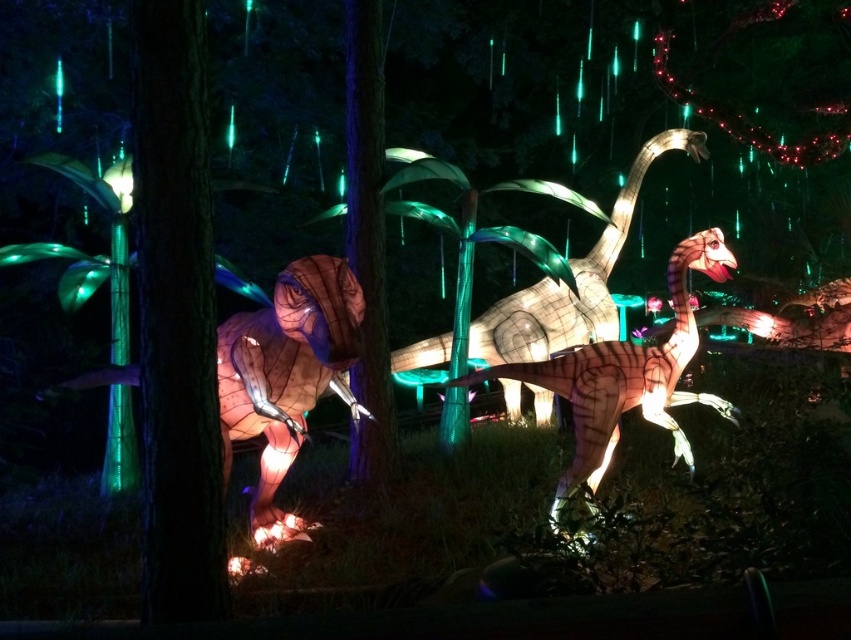
You are a photographer trying to capture the translucent paper dinosaur at left and the matte brown dinosaur at center in a single shot. Which dinosaur should you focus on first to ensure both are in focus?

You should focus on the matte brown dinosaur at center first because it is farther away from the viewer than the translucent paper dinosaur at left, so adjusting focus from the farther object will help both be in focus.

You are a visitor at a light art exhibition and see the translucent paper dinosaur at left and the translucent white dinosaur at center. Which dinosaur appears taller from your viewpoint?

The translucent white dinosaur at center is taller than the translucent paper dinosaur at left.

You are standing in front of the nighttime dinosaur exhibit. You see the translucent paper dinosaur at left and the matte brown dinosaur at center. Which dinosaur is closer to your left side?

The translucent paper dinosaur at left is closer to your left side because it is positioned to the left of the matte brown dinosaur at center.